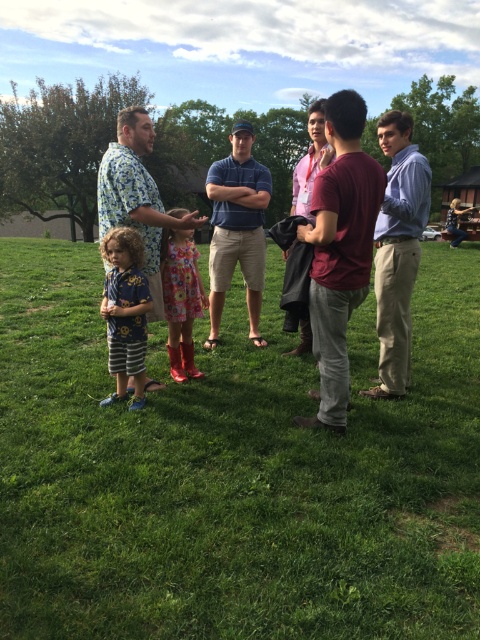
Is green grass at center thinner than blue cotton polo shirt at center?

No.

Is green grass at center taller than blue cotton polo shirt at center?

In fact, green grass at center may be shorter than blue cotton polo shirt at center.

What do you see at coordinates (233, 474) in the screenshot?
I see `green grass at center` at bounding box center [233, 474].

This screenshot has width=480, height=640. In order to click on green grass at center in this screenshot , I will do `click(233, 474)`.

Which of these two, blue cotton polo shirt at center or blue printed shirt at lower left, stands taller?

blue cotton polo shirt at center is taller.

Image resolution: width=480 pixels, height=640 pixels. What do you see at coordinates (238, 228) in the screenshot? I see `blue cotton polo shirt at center` at bounding box center [238, 228].

The image size is (480, 640). I want to click on blue cotton polo shirt at center, so click(238, 228).

Is maroon cotton t-shirt at center to the right of maroon cotton shirt at center from the viewer's perspective?

In fact, maroon cotton t-shirt at center is to the left of maroon cotton shirt at center.

Is maroon cotton t-shirt at center wider than maroon cotton shirt at center?

In fact, maroon cotton t-shirt at center might be narrower than maroon cotton shirt at center.

Is point (347, 253) more distant than point (310, 115)?

No, it is not.

Find the location of a particular element. The image size is (480, 640). maroon cotton t-shirt at center is located at coordinates (339, 250).